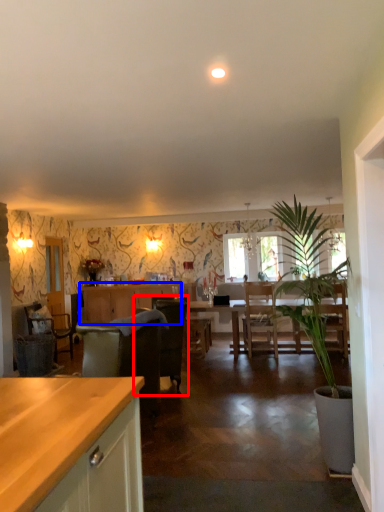
Question: Which object appears farthest to the camera in this image, chair (highlighted by a red box) or cabinetry (highlighted by a blue box)?

Choices:
 (A) chair
 (B) cabinetry

Answer: (B)